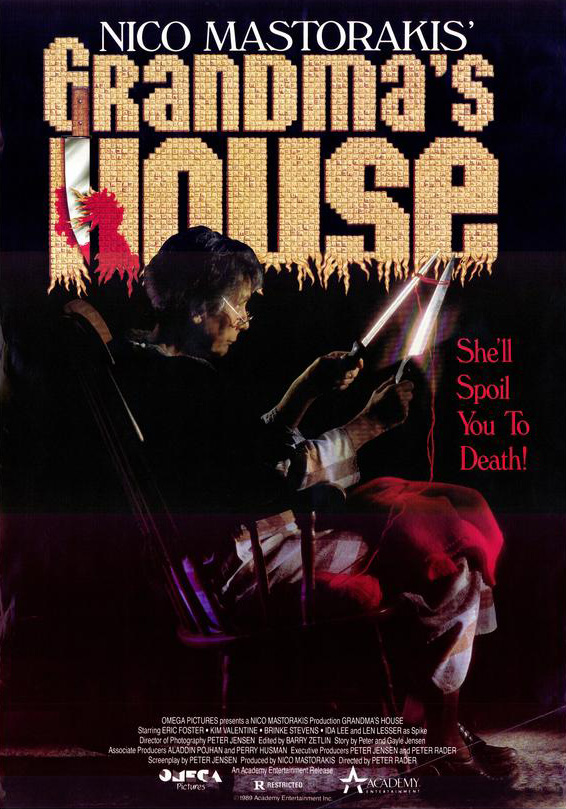
Where is `floor`? Image resolution: width=566 pixels, height=809 pixels. floor is located at coordinates (543, 769).